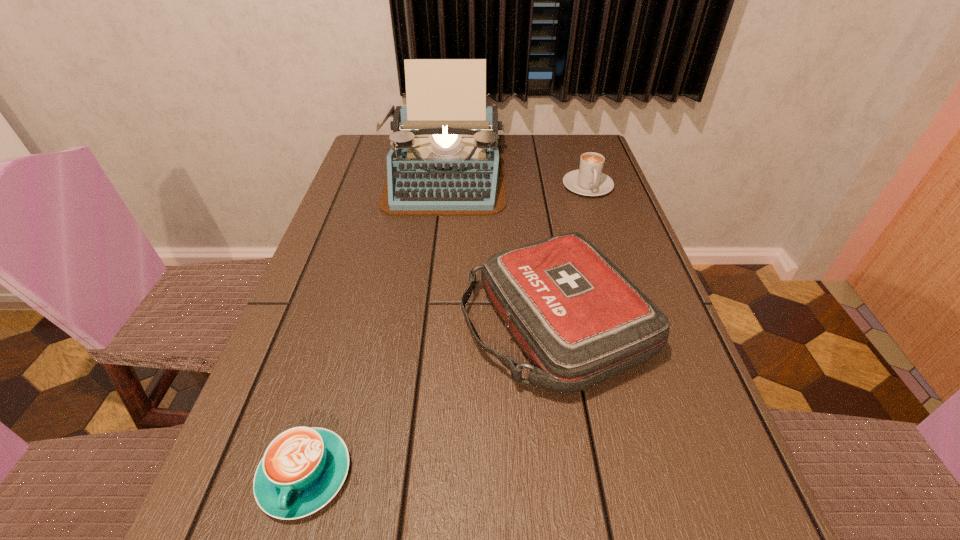
At what (x,y) coordinates should I click in order to perform the action: click on free space between the tallest object and the second shortest object. Please return your answer as a coordinate pair (x, y). This screenshot has width=960, height=540. Looking at the image, I should click on (516, 180).

The height and width of the screenshot is (540, 960). Identify the location of free space between the second nearest object and the shortest object. (430, 400).

This screenshot has width=960, height=540. What are the coordinates of `free space that is in between the nearer cappuccino and the third farthest object` in the screenshot? It's located at (430, 400).

This screenshot has width=960, height=540. I want to click on vacant area that lies between the typewriter and the nearer cappuccino, so click(x=374, y=325).

Identify the location of vacant area that lies between the tallest object and the third shortest object. (499, 249).

I want to click on vacant region between the first-aid kit and the typewriter, so click(x=499, y=249).

This screenshot has height=540, width=960. I want to click on vacant space that is in between the left cappuccino and the right cappuccino, so click(x=446, y=330).

Where is `vacant point located between the first-aid kit and the typewriter`? The width and height of the screenshot is (960, 540). vacant point located between the first-aid kit and the typewriter is located at coordinates (499, 249).

I want to click on the third closest object to the first-aid kit, so click(x=588, y=180).

You are a GUI agent. You are given a task and a screenshot of the screen. Output one action in this format:
    pyautogui.click(x=<x>, y=<y>)
    Task: Click on the object that is the third closest to the shortest object
    The image size is (960, 540).
    Given the screenshot: What is the action you would take?
    pyautogui.click(x=588, y=180)